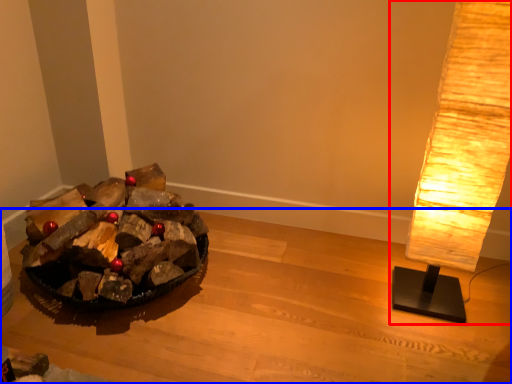
Question: Which object is further to the camera taking this photo, lamp (highlighted by a red box) or furniture (highlighted by a blue box)?

Choices:
 (A) lamp
 (B) furniture

Answer: (A)